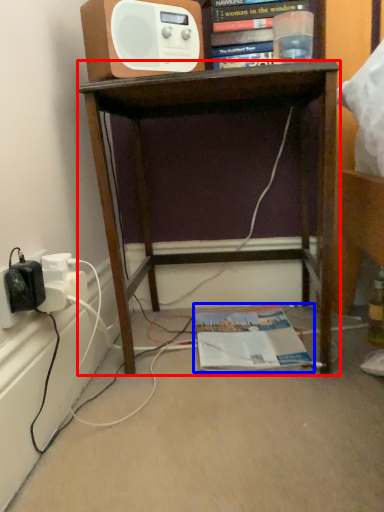
Question: Among these objects, which one is nearest to the camera, desk (highlighted by a red box) or magazine (highlighted by a blue box)?

Choices:
 (A) desk
 (B) magazine

Answer: (A)